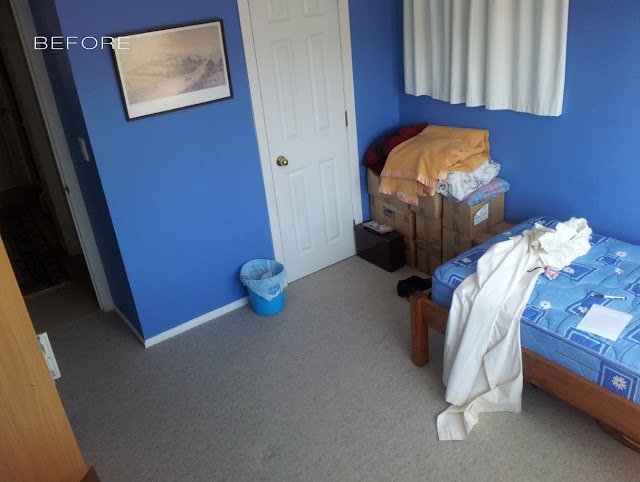
The width and height of the screenshot is (640, 482). What are the coordinates of `cardboard boxes` in the screenshot? It's located at (454, 219), (452, 240), (422, 263), (425, 235), (428, 211), (374, 188), (386, 209), (411, 244).